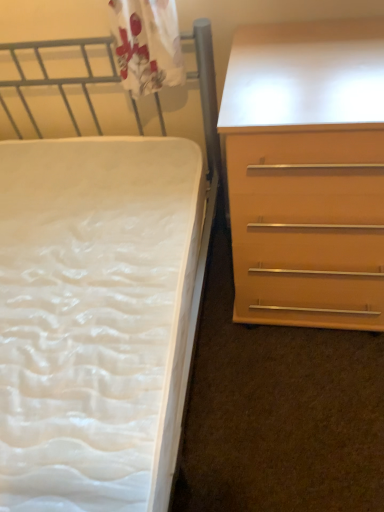
You are a GUI agent. You are given a task and a screenshot of the screen. Output one action in this format:
    pyautogui.click(x=<x>, y=<y>)
    Task: Click on the free area in between white textured mattress at left and light brown wood chest of drawers at right
    The height and width of the screenshot is (512, 384).
    Given the screenshot: What is the action you would take?
    pyautogui.click(x=277, y=402)